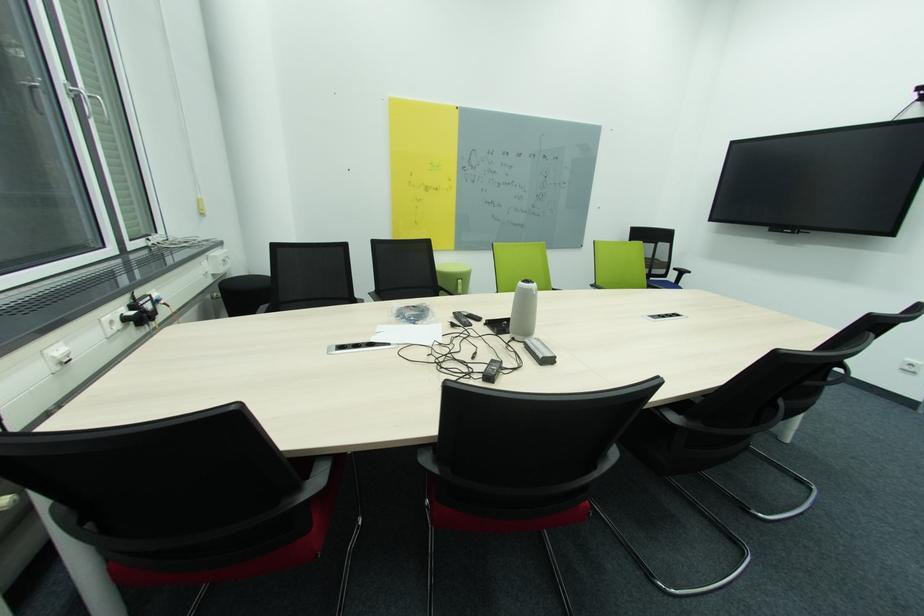
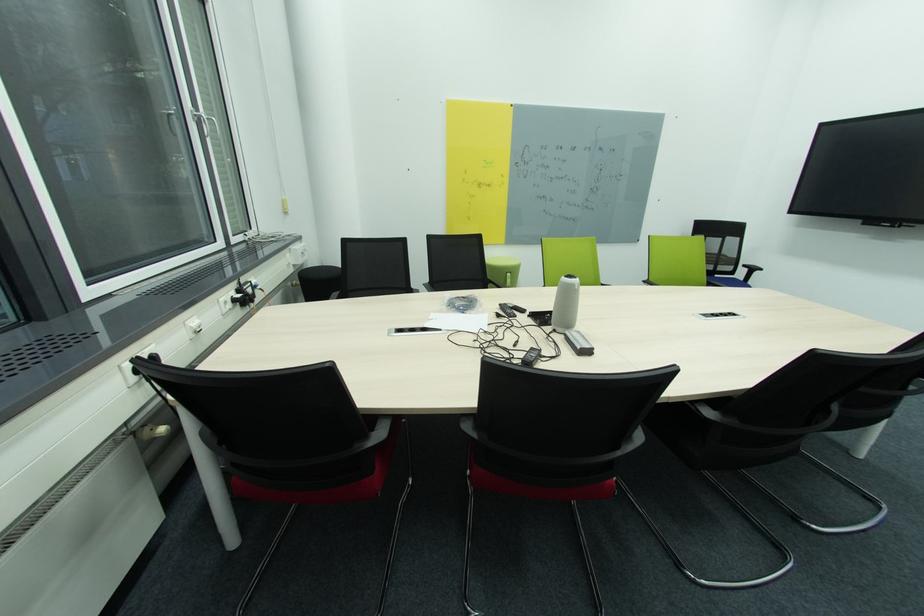
The point at (465, 282) is marked in the first image. Where is the corresponding point in the second image?

(514, 276)